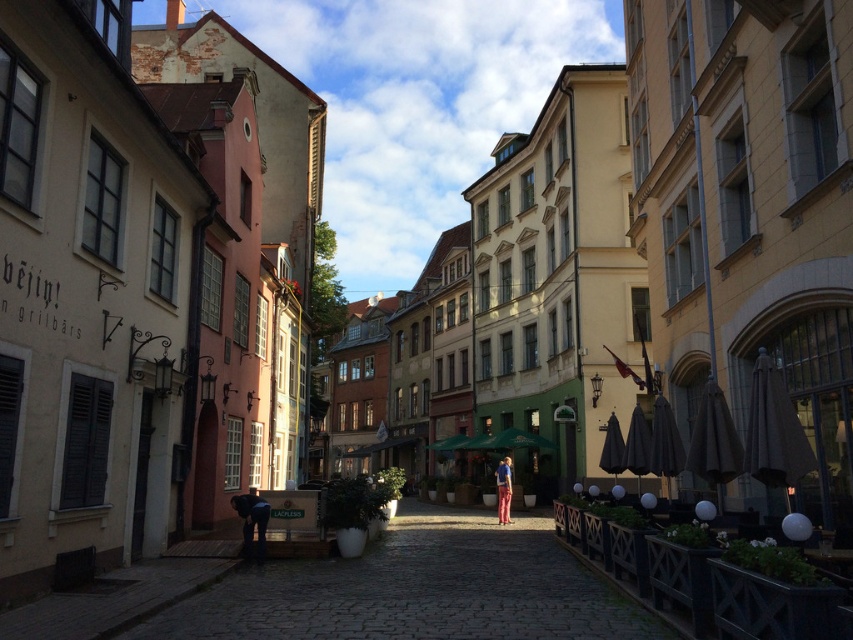
Question: Where is smooth wooden bench at center located in relation to matte black jacket at lower left in the image?

Choices:
 (A) below
 (B) above

Answer: (A)

Question: Which object appears closest to the camera in this image?

Choices:
 (A) matte black jacket at lower left
 (B) smooth wooden bench at center

Answer: (B)

Question: Does matte black jacket at lower left have a larger size compared to blue denim shirt at center?

Choices:
 (A) no
 (B) yes

Answer: (A)

Question: Which point appears closest to the camera in this image?

Choices:
 (A) click(244, 636)
 (B) click(502, 472)

Answer: (A)

Question: Can you confirm if smooth wooden bench at center is positioned to the left of blue denim shirt at center?

Choices:
 (A) no
 (B) yes

Answer: (B)

Question: Which point is farther to the camera?

Choices:
 (A) (500, 472)
 (B) (236, 513)
 (C) (357, 621)

Answer: (A)